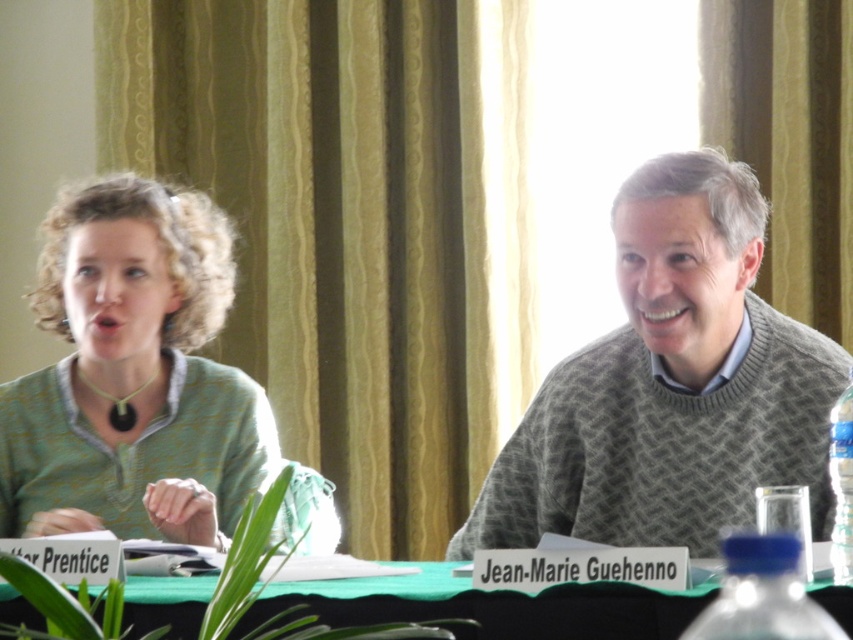
Which is behind, point (189, 452) or point (575, 605)?

Positioned behind is point (189, 452).

What do you see at coordinates (132, 374) in the screenshot?
I see `green matte sweater at left` at bounding box center [132, 374].

Where is `green matte sweater at left`? green matte sweater at left is located at coordinates (132, 374).

Which is more to the right, green knitted sweater at upper center or green matte sweater at left?

green knitted sweater at upper center

The width and height of the screenshot is (853, 640). Identify the location of green knitted sweater at upper center. (671, 385).

Is green matte sweater at left positioned behind clear plastic bottle at right?

Yes, green matte sweater at left is further from the viewer.

Between green matte sweater at left and clear plastic bottle at right, which one appears on the right side from the viewer's perspective?

From the viewer's perspective, clear plastic bottle at right appears more on the right side.

Find the location of `green matte sweater at left`. green matte sweater at left is located at coordinates (132, 374).